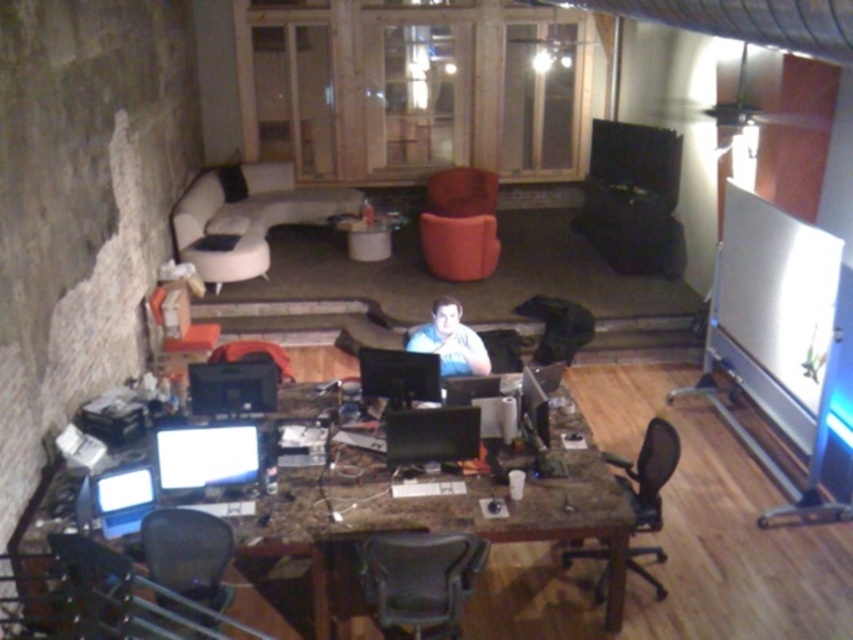
You are standing at the entrance of the office and want to move to the white leather couch at upper left. The distance between you and the couch is 7.85 meters. If your maximum walking distance is 8 meters, can you reach the couch without needing to rest?

The distance between you and the white leather couch at upper left is 7.85 meters, which is within your maximum walking distance of 8 meters. Therefore, you can reach the couch without needing to rest.

You are a delivery person who needs to place a package between the black leather office chair at lower right and the light blue shirt at center. The package is 1.5 meters long. Can you fit it between them?

The distance between the black leather office chair at lower right and the light blue shirt at center is 1.40 meters, which is shorter than the package length of 1.5 meters. Therefore, the package cannot be placed between them.

You are sitting in the velvet orange armchair at center and want to reach the black leather office chair at lower right. Can you move directly to it without moving around any other furniture?

The black leather office chair at lower right is behind the velvet orange armchair at center, so you would need to move around the velvet orange armchair at center to reach it directly.